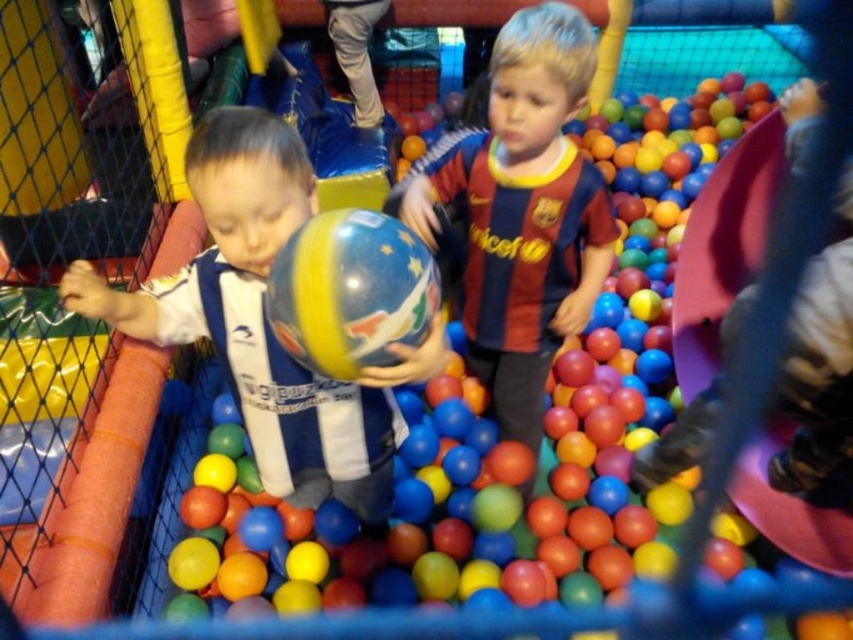
What is the exact position of the glossy plastic beach ball at center?

The glossy plastic beach ball at center is located at point (355, 298).

You are a child trying to grab the glossy plastic beach ball at center and the glossy rubber ball at center. Which one can you reach first without moving your position?

The glossy plastic beach ball at center is closer to the viewer than the glossy rubber ball at center, so you can reach it first.